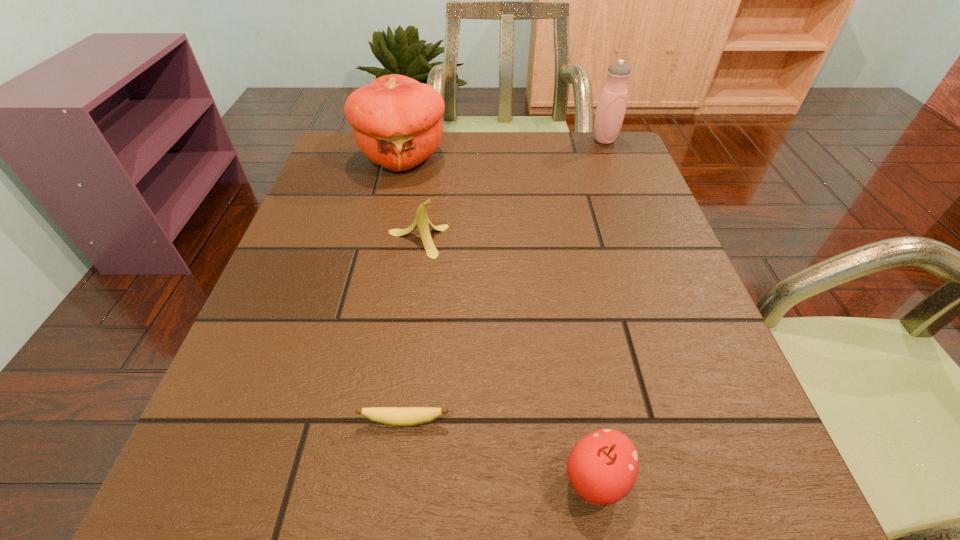
Identify the location of the rightmost object. (611, 107).

Where is `pumpkin`? The width and height of the screenshot is (960, 540). pumpkin is located at coordinates (396, 120).

Locate an element on the screen. This screenshot has width=960, height=540. the taller banana is located at coordinates (422, 222).

Identify the location of the third farthest object. (422, 222).

What are the coordinates of `apple` in the screenshot? It's located at [602, 467].

At what (x,y) coordinates should I click in order to perform the action: click on the second object from right to left. Please return your answer as a coordinate pair (x, y). The image size is (960, 540). Looking at the image, I should click on (602, 467).

Find the location of a particular element. The width and height of the screenshot is (960, 540). the shorter banana is located at coordinates (395, 416).

At what (x,y) coordinates should I click in order to perform the action: click on the nearer banana. Please return your answer as a coordinate pair (x, y). This screenshot has height=540, width=960. Looking at the image, I should click on (395, 416).

Identify the location of free space located 0.240m on the left of the thermos bottle. (502, 140).

The image size is (960, 540). What are the coordinates of `free region located 0.400m on the front of the pumpkin` in the screenshot? It's located at (367, 310).